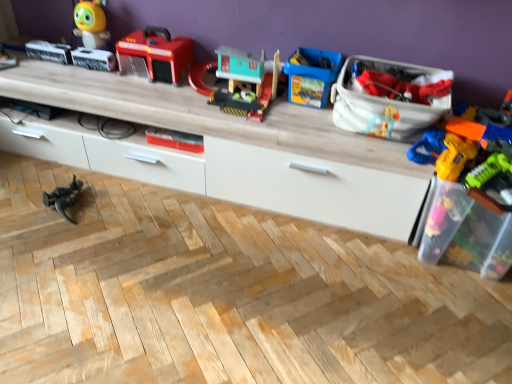
In order to face transparent plastic toy box at right, marked as the first storage box in a right-to-left arrangement, should I rotate leftwards or rightwards?

Turn right by 26.955 degrees to look at transparent plastic toy box at right, marked as the first storage box in a right-to-left arrangement.

Where is `matte plastic toy at center, which is counted as the fourth toy, starting from the left`? The width and height of the screenshot is (512, 384). matte plastic toy at center, which is counted as the fourth toy, starting from the left is located at coordinates (175, 140).

Locate an element on the screen. wooden entertainment center at upper center is located at coordinates [225, 150].

What are the coordinates of `translucent plastic toy gun at right, which ranks as the 7th toy in left-to-right order` in the screenshot? It's located at (472, 151).

Identify the location of transparent plastic toy box at right, the 2th storage box from the left. The image size is (512, 384). (465, 233).

Considering the sizes of objects matte plastic fire truck at upper center, the third toy when ordered from left to right, and white fabric bag at upper right, which appears as the second storage box when viewed from the right, in the image provided, who is bigger, matte plastic fire truck at upper center, the third toy when ordered from left to right, or white fabric bag at upper right, which appears as the second storage box when viewed from the right,?

With larger size is white fabric bag at upper right, which appears as the second storage box when viewed from the right.

Is matte plastic fire truck at upper center, the third toy when ordered from left to right, completely or partially outside of white fabric bag at upper right, which appears as the second storage box when viewed from the right?

Absolutely, matte plastic fire truck at upper center, the third toy when ordered from left to right, is external to white fabric bag at upper right, which appears as the second storage box when viewed from the right.

From the picture: Is matte plastic fire truck at upper center, which is the 5th toy from right to left, oriented away from white fabric bag at upper right, which appears as the second storage box when viewed from the right?

No, matte plastic fire truck at upper center, which is the 5th toy from right to left, is not facing away from white fabric bag at upper right, which appears as the second storage box when viewed from the right.

Could you measure the distance between matte plastic fire truck at upper center, the third toy when ordered from left to right, and white fabric bag at upper right, which is counted as the first storage box, starting from the left?

33.91 inches.

Does point (160, 134) lie in front of point (452, 222)?

No, it is behind (452, 222).

Is matte plastic toy at center, which is counted as the fourth toy, starting from the left, with transparent plastic toy box at right, the 2th storage box from the left?

matte plastic toy at center, which is counted as the fourth toy, starting from the left, and transparent plastic toy box at right, the 2th storage box from the left, are not in contact.

From the picture: Considering the relative sizes of matte plastic toy at center, which is the 4th toy from right to left, and transparent plastic toy box at right, the 2th storage box from the left, in the image provided, is matte plastic toy at center, which is the 4th toy from right to left, thinner than transparent plastic toy box at right, the 2th storage box from the left,?

Yes, matte plastic toy at center, which is the 4th toy from right to left, is thinner than transparent plastic toy box at right, the 2th storage box from the left.

How many degrees apart are the facing directions of matte plastic toy at center, which is counted as the fourth toy, starting from the left, and transparent plastic toy box at right, marked as the first storage box in a right-to-left arrangement?

The angular difference between matte plastic toy at center, which is counted as the fourth toy, starting from the left, and transparent plastic toy box at right, marked as the first storage box in a right-to-left arrangement, is 0.751 degrees.

From a real-world perspective, which toy is the 3rd one underneath the blue plastic toy at center, marked as the 6th toy in a left-to-right arrangement? Please provide its 2D coordinates.

[(64, 197)]

Between black plastic dinosaur at lower left, the 7th toy from the right, and blue plastic toy at center, the 2th toy from the right, which one has larger size?

With larger size is blue plastic toy at center, the 2th toy from the right.

Is the depth of black plastic dinosaur at lower left, which is the first toy from left to right, greater than that of blue plastic toy at center, the 2th toy from the right?

Yes.

What's the angular difference between black plastic dinosaur at lower left, the 7th toy from the right, and blue plastic toy at center, the 2th toy from the right,'s facing directions?

The facing directions of black plastic dinosaur at lower left, the 7th toy from the right, and blue plastic toy at center, the 2th toy from the right, are 95.5 degrees apart.

Considering the sizes of objects white fabric bag at upper right, which is counted as the first storage box, starting from the left, and wooden entertainment center at upper center in the image provided, who is taller, white fabric bag at upper right, which is counted as the first storage box, starting from the left, or wooden entertainment center at upper center?

Standing taller between the two is wooden entertainment center at upper center.

Which of these two, white fabric bag at upper right, which is counted as the first storage box, starting from the left, or wooden entertainment center at upper center, is smaller?

white fabric bag at upper right, which is counted as the first storage box, starting from the left, is smaller.

From the image's perspective, between white fabric bag at upper right, which appears as the second storage box when viewed from the right, and wooden entertainment center at upper center, who is located below?

wooden entertainment center at upper center.

From a real-world perspective, is white fabric bag at upper right, which is counted as the first storage box, starting from the left, physically below wooden entertainment center at upper center?

Actually, white fabric bag at upper right, which is counted as the first storage box, starting from the left, is physically above wooden entertainment center at upper center in the real world.

From the image's perspective, who appears lower, white fabric bag at upper right, which appears as the second storage box when viewed from the right, or translucent plastic toy gun at right, which ranks as the 7th toy in left-to-right order?

translucent plastic toy gun at right, which ranks as the 7th toy in left-to-right order, from the image's perspective.

Could you tell me if white fabric bag at upper right, which is counted as the first storage box, starting from the left, is turned towards translucent plastic toy gun at right, positioned as the first toy in right-to-left order?

No, white fabric bag at upper right, which is counted as the first storage box, starting from the left, does not turn towards translucent plastic toy gun at right, positioned as the first toy in right-to-left order.

Is there a large distance between white fabric bag at upper right, which is counted as the first storage box, starting from the left, and translucent plastic toy gun at right, which ranks as the 7th toy in left-to-right order?

No, white fabric bag at upper right, which is counted as the first storage box, starting from the left, is in close proximity to translucent plastic toy gun at right, which ranks as the 7th toy in left-to-right order.

Can you tell me how much white fabric bag at upper right, which appears as the second storage box when viewed from the right, and translucent plastic toy gun at right, positioned as the first toy in right-to-left order, differ in facing direction?

The facing directions of white fabric bag at upper right, which appears as the second storage box when viewed from the right, and translucent plastic toy gun at right, positioned as the first toy in right-to-left order, are 1.36 degrees apart.

Is matte plastic toy at center, which is counted as the fourth toy, starting from the left, located outside shiny plastic toy at upper left, which is the 6th toy in right-to-left order?

That's correct, matte plastic toy at center, which is counted as the fourth toy, starting from the left, is outside of shiny plastic toy at upper left, which is the 6th toy in right-to-left order.

Considering the sizes of objects matte plastic toy at center, which is the 4th toy from right to left, and shiny plastic toy at upper left, the second toy in the left-to-right sequence, in the image provided, who is wider, matte plastic toy at center, which is the 4th toy from right to left, or shiny plastic toy at upper left, the second toy in the left-to-right sequence,?

With larger width is matte plastic toy at center, which is the 4th toy from right to left.

This screenshot has width=512, height=384. What are the coordinates of `toy behind the matte plastic toy at center, which is counted as the fourth toy, starting from the left` in the screenshot? It's located at (90, 24).

Which is in front, point (231, 144) or point (270, 65)?

The point (231, 144) is in front.

Looking at this image, is wooden entertainment center at upper center positioned far away from matte plastic toy house at center, which is the 3th toy in right-to-left order?

wooden entertainment center at upper center is actually quite close to matte plastic toy house at center, which is the 3th toy in right-to-left order.

How distant is wooden entertainment center at upper center from matte plastic toy house at center, which is the 3th toy in right-to-left order?

wooden entertainment center at upper center and matte plastic toy house at center, which is the 3th toy in right-to-left order, are 10.42 inches apart from each other.

From a real-world perspective, is wooden entertainment center at upper center positioned over matte plastic toy house at center, which is the 5th toy from left to right, based on gravity?

No, from a real-world perspective, wooden entertainment center at upper center is not on top of matte plastic toy house at center, which is the 5th toy from left to right.

This screenshot has height=384, width=512. Identify the location of the 1st storage box in front of the matte plastic fire truck at upper center, the third toy when ordered from left to right, starting your count from the anchor. (389, 97).

This screenshot has width=512, height=384. I want to click on the 1st toy above the transparent plastic toy box at right, marked as the first storage box in a right-to-left arrangement (from a real-world perspective), so click(175, 140).

Based on their spatial positions, is transparent plastic toy box at right, the 2th storage box from the left, or wooden entertainment center at upper center further from matte plastic toy house at center, which is the 3th toy in right-to-left order?

transparent plastic toy box at right, the 2th storage box from the left, lies further to matte plastic toy house at center, which is the 3th toy in right-to-left order, than the other object.

Looking at the image, which one is located further to matte plastic toy at center, which is the 4th toy from right to left, shiny plastic toy at upper left, the second toy in the left-to-right sequence, or black plastic dinosaur at lower left, the 7th toy from the right?

Among the two, shiny plastic toy at upper left, the second toy in the left-to-right sequence, is located further to matte plastic toy at center, which is the 4th toy from right to left.

Consider the image. Looking at the image, which one is located further to matte plastic toy house at center, which is the 3th toy in right-to-left order, translucent plastic toy gun at right, which ranks as the 7th toy in left-to-right order, or matte plastic toy at center, which is counted as the fourth toy, starting from the left?

The object further to matte plastic toy house at center, which is the 3th toy in right-to-left order, is translucent plastic toy gun at right, which ranks as the 7th toy in left-to-right order.

Looking at the image, which one is located further to matte plastic toy at center, which is the 4th toy from right to left, blue plastic toy at center, marked as the 6th toy in a left-to-right arrangement, or black plastic dinosaur at lower left, which is the first toy from left to right?

blue plastic toy at center, marked as the 6th toy in a left-to-right arrangement.

Based on their spatial positions, is transparent plastic toy box at right, marked as the first storage box in a right-to-left arrangement, or matte plastic toy at center, which is counted as the fourth toy, starting from the left, further from shiny plastic toy at upper left, which is the 6th toy in right-to-left order?

The object further to shiny plastic toy at upper left, which is the 6th toy in right-to-left order, is transparent plastic toy box at right, marked as the first storage box in a right-to-left arrangement.

When comparing their distances from shiny plastic toy at upper left, the second toy in the left-to-right sequence, does translucent plastic toy gun at right, positioned as the first toy in right-to-left order, or black plastic dinosaur at lower left, which is the first toy from left to right, seem further?

Among the two, translucent plastic toy gun at right, positioned as the first toy in right-to-left order, is located further to shiny plastic toy at upper left, the second toy in the left-to-right sequence.

Considering their positions, is translucent plastic toy gun at right, which ranks as the 7th toy in left-to-right order, positioned further to wooden entertainment center at upper center than matte plastic fire truck at upper center, which is the 5th toy from right to left?

Among the two, translucent plastic toy gun at right, which ranks as the 7th toy in left-to-right order, is located further to wooden entertainment center at upper center.

When comparing their distances from transparent plastic toy box at right, marked as the first storage box in a right-to-left arrangement, does matte plastic toy at center, which is counted as the fourth toy, starting from the left, or wooden entertainment center at upper center seem closer?

Based on the image, wooden entertainment center at upper center appears to be nearer to transparent plastic toy box at right, marked as the first storage box in a right-to-left arrangement.

Find the location of `storage box between matte plastic toy at center, which is counted as the fourth toy, starting from the left, and transparent plastic toy box at right, marked as the first storage box in a right-to-left arrangement, from left to right`. storage box between matte plastic toy at center, which is counted as the fourth toy, starting from the left, and transparent plastic toy box at right, marked as the first storage box in a right-to-left arrangement, from left to right is located at coordinates (389, 97).

This screenshot has width=512, height=384. Find the location of `toy located between blue plastic toy at center, the 2th toy from the right, and transparent plastic toy box at right, the 2th storage box from the left, in the left-right direction`. toy located between blue plastic toy at center, the 2th toy from the right, and transparent plastic toy box at right, the 2th storage box from the left, in the left-right direction is located at coordinates (472, 151).

Locate an element on the screen. entertainment center between shiny plastic toy at upper left, the second toy in the left-to-right sequence, and matte plastic toy at center, which is the 4th toy from right to left, in the vertical direction is located at coordinates (225, 150).

Where is `entertainment center between matte plastic fire truck at upper center, the third toy when ordered from left to right, and black plastic dinosaur at lower left, which is the first toy from left to right, from top to bottom`? entertainment center between matte plastic fire truck at upper center, the third toy when ordered from left to right, and black plastic dinosaur at lower left, which is the first toy from left to right, from top to bottom is located at coordinates (225, 150).